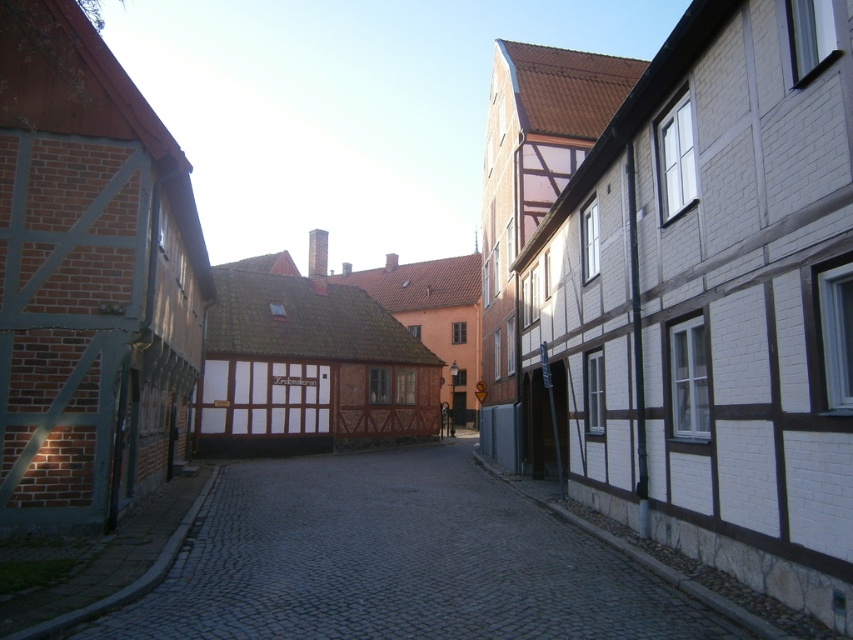
You are standing on the cobblestone street and want to walk from point A to point B. Point A is located at coordinate point (759, 272) and point B is at coordinate point (572, 595). Since you can only move forward, will you pass by point B before reaching point A?

Point (759, 272) is in front of point (572, 595), so you will reach point A before point B. Therefore, you will not pass by point B before reaching point A.

Looking at this image, you are standing on the cobblestone street and want to locate the point at coordinates (709,305). According to the scene description, which building should you look towards?

The point at coordinates (709,305) is located on the white wooden building at right, so you should look towards the white wooden building at right to find it.

Looking at this image, you are standing on the cobblestone street and want to take a photo of the white wooden building at right and the gray cobblestone alley at center. Which object should you focus on first to ensure both are in the frame?

You should focus on the white wooden building at right first because it is closer to you than the gray cobblestone alley at center, so it will be in the foreground while the alley remains in the background, ensuring both are visible in the frame.